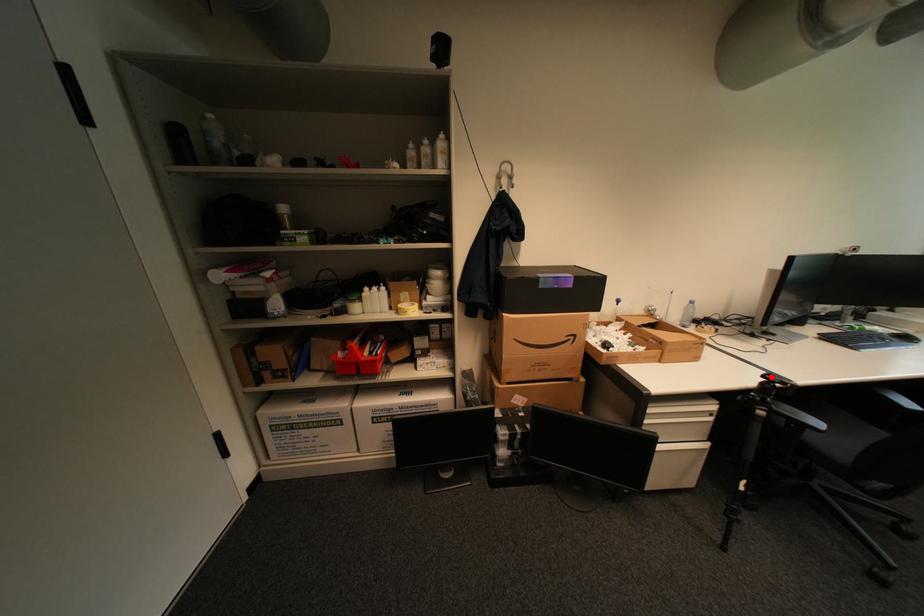
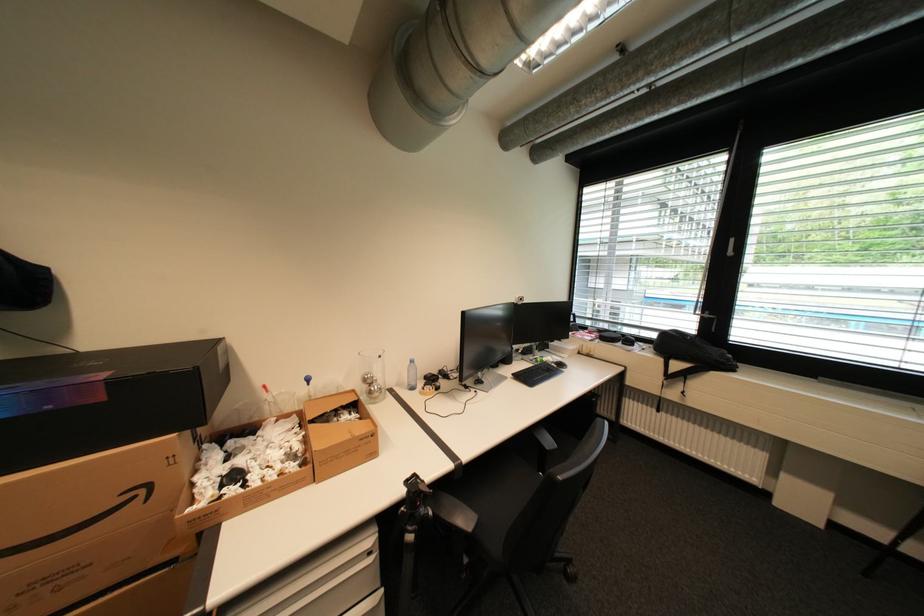
Where in the second image is the point corresponding to the highlighted location from the first image?

(416, 484)